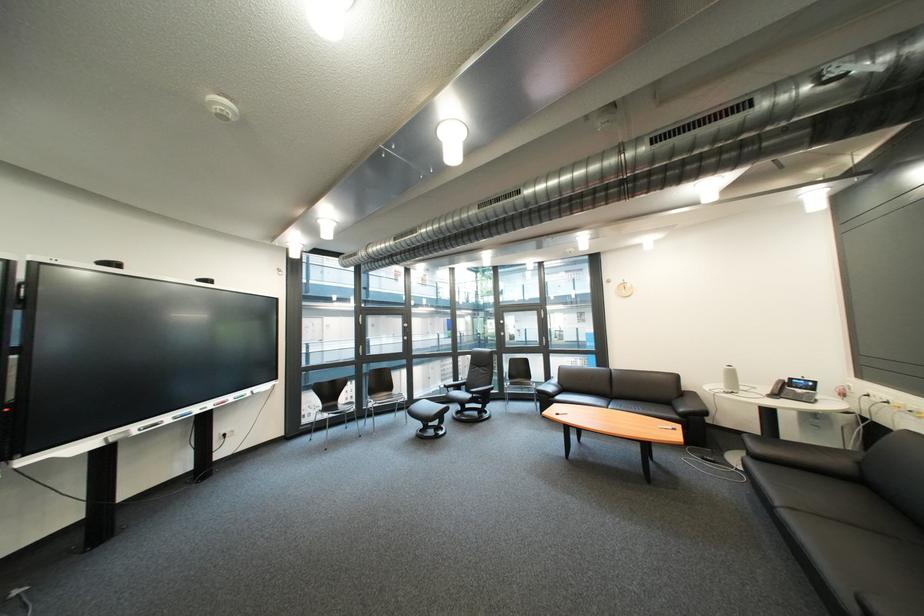
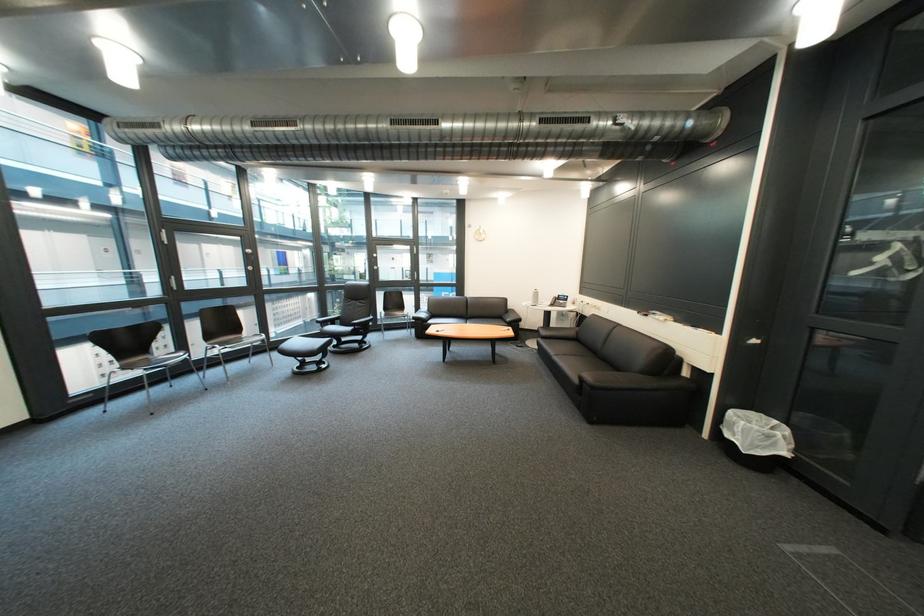
Find the pixel in the second image that matches (751,390) in the first image.

(552, 305)